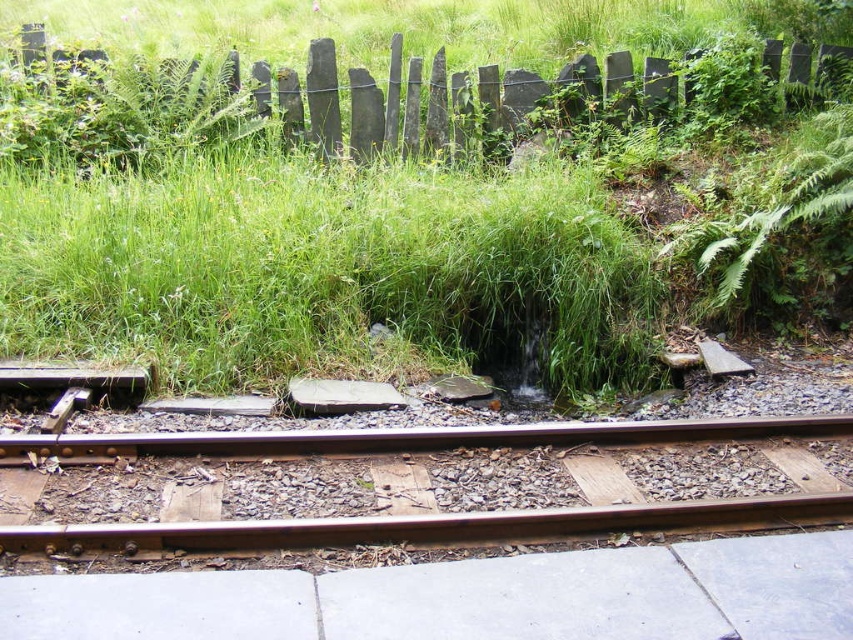
Question: Does brown wooden train track at center appear over rusty metal fence at upper center?

Choices:
 (A) no
 (B) yes

Answer: (A)

Question: Among these objects, which one is farthest from the camera?

Choices:
 (A) green grass at center
 (B) rusty metal fence at upper center
 (C) brown wooden train track at center

Answer: (B)

Question: Can you confirm if green grass at center is smaller than rusty metal fence at upper center?

Choices:
 (A) yes
 (B) no

Answer: (A)

Question: Which point appears closest to the camera in this image?

Choices:
 (A) (527, 529)
 (B) (480, 205)

Answer: (A)

Question: Which is farther from the green grass at center?

Choices:
 (A) rusty metal fence at upper center
 (B) brown wooden train track at center

Answer: (B)

Question: Can you confirm if brown wooden train track at center is smaller than rusty metal fence at upper center?

Choices:
 (A) no
 (B) yes

Answer: (A)